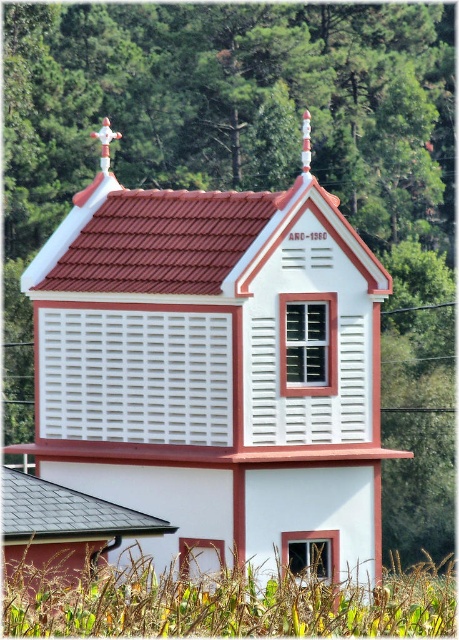
You are standing in front of the white louvered chapel at center and want to see the gray slate roof at lower left. Can you see it clearly without moving your position?

The gray slate roof at lower left is behind the white louvered chapel at center, so you cannot see it clearly from your current position without moving.

You are a painter standing in front of the white louvered chapel at center and the gray slate roof at lower left. You want to paint both objects but have only enough paint to cover 10 square meters. Which object should you choose to paint first if you want to ensure you can finish painting one object completely?

The white louvered chapel at center might be wider than gray slate roof at lower left, so it likely has a larger surface area. To ensure you can finish painting one object completely, you should paint the gray slate roof at lower left first since it is smaller.